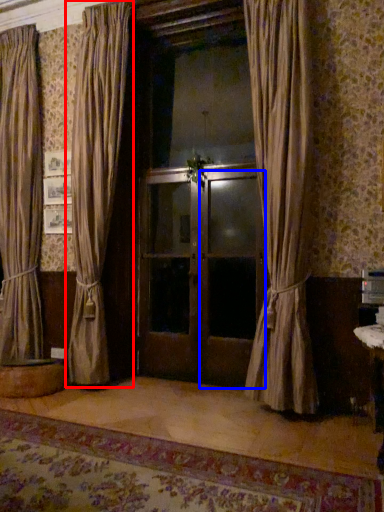
Question: Which object appears closest to the camera in this image, curtain (highlighted by a red box) or screen door (highlighted by a blue box)?

Choices:
 (A) curtain
 (B) screen door

Answer: (A)